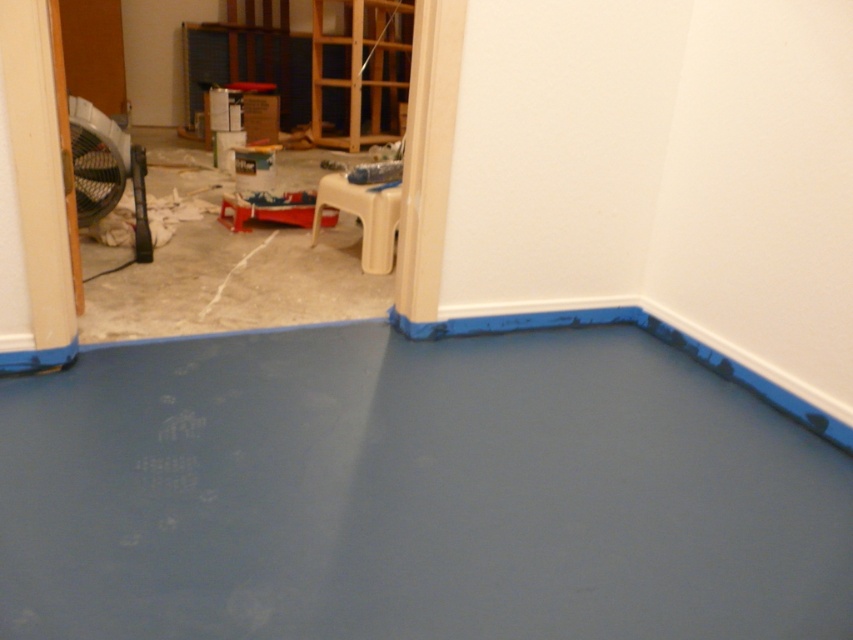
Is smooth concrete floor at center to the left of white concrete floor at left from the viewer's perspective?

In fact, smooth concrete floor at center is to the right of white concrete floor at left.

Is the position of smooth concrete floor at center more distant than that of white concrete floor at left?

No, it is in front of white concrete floor at left.

Does point (97, 525) lie in front of point (183, 170)?

Yes, point (97, 525) is in front of point (183, 170).

The width and height of the screenshot is (853, 640). What are the coordinates of `smooth concrete floor at center` in the screenshot? It's located at (413, 492).

Between smooth concrete floor at center and matte black fan at left, which one appears on the right side from the viewer's perspective?

Positioned to the right is smooth concrete floor at center.

Can you confirm if smooth concrete floor at center is thinner than matte black fan at left?

Incorrect, smooth concrete floor at center's width is not less than matte black fan at left's.

What do you see at coordinates (413, 492) in the screenshot? The height and width of the screenshot is (640, 853). I see `smooth concrete floor at center` at bounding box center [413, 492].

Locate an element on the screen. Image resolution: width=853 pixels, height=640 pixels. smooth concrete floor at center is located at coordinates (413, 492).

Is white concrete floor at left wider than matte black fan at left?

Yes.

Who is more distant from viewer, (288, 241) or (115, 140)?

Positioned behind is point (288, 241).

Is point (352, 161) farther from viewer compared to point (114, 170)?

Yes.

The height and width of the screenshot is (640, 853). Identify the location of white concrete floor at left. (225, 266).